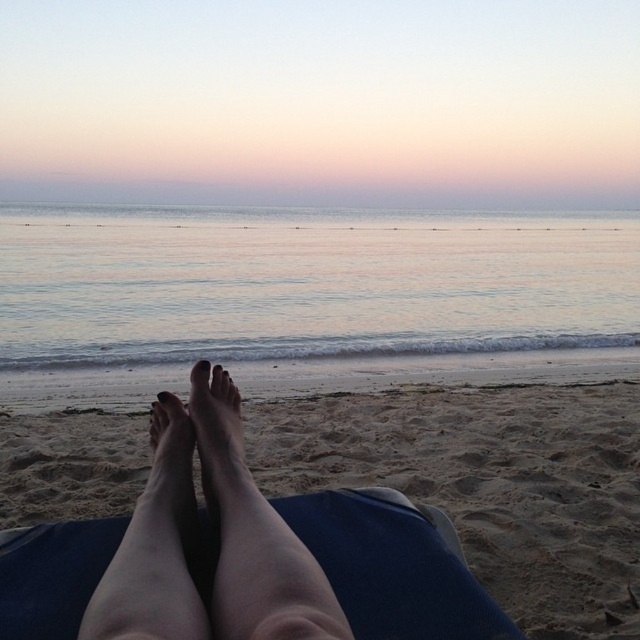
You are a photographer taking a picture of the sandy beach at lower center and the matte skin toe at center. Which object will appear larger in the photo?

The sandy beach at lower center will appear larger in the photo because it is much taller than the matte skin toe at center.

You are standing on the beach and want to take a photo of the pastel pink sky at upper center. If your camera can focus on objects up to 100 feet away, will it be able to capture the sky clearly?

The pastel pink sky at upper center is 117.78 feet from the viewer, which is beyond the camera lens focus range of 100 feet. Therefore, the camera cannot focus on the sky and capture it clearly.